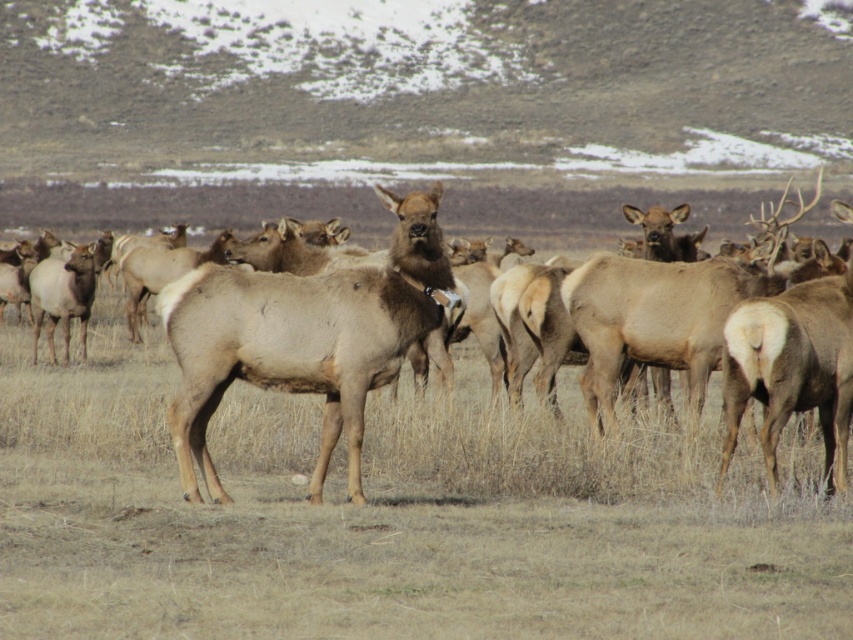
Question: In this image, where is brown matte/deer at center located relative to brown fur deer at center?

Choices:
 (A) left
 (B) right

Answer: (A)

Question: Which object appears closest to the camera in this image?

Choices:
 (A) brown matte/deer at center
 (B) brown fur deer at center

Answer: (B)

Question: Is brown matte/deer at center to the right of brown fur deer at center from the viewer's perspective?

Choices:
 (A) no
 (B) yes

Answer: (A)

Question: Is brown matte/deer at center behind brown fur deer at center?

Choices:
 (A) no
 (B) yes

Answer: (B)